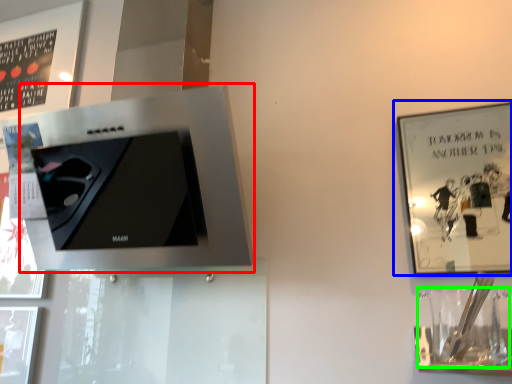
Question: Which is nearer to the appliance (highlighted by a red box)? picture frame (highlighted by a blue box) or wine glass (highlighted by a green box).

Choices:
 (A) picture frame
 (B) wine glass

Answer: (B)